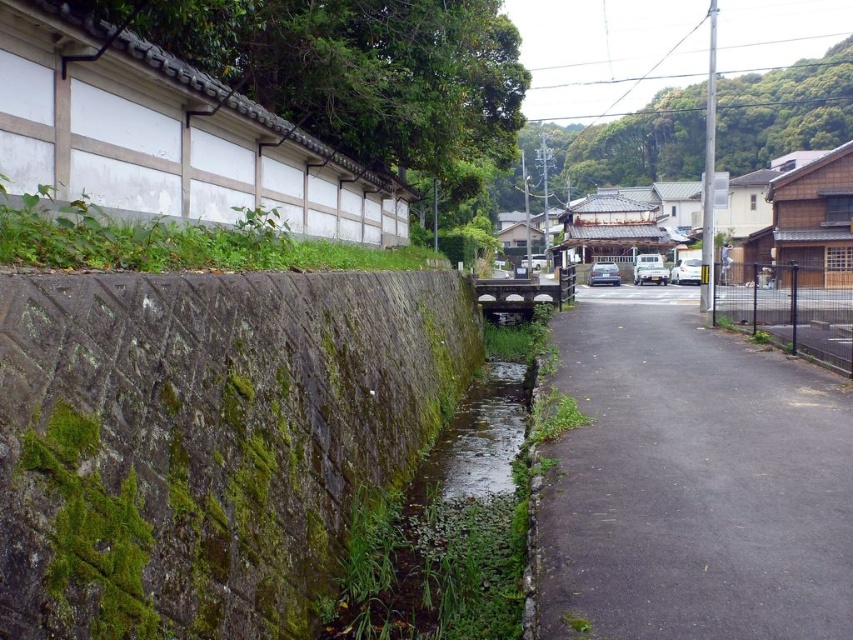
You are a pedestrian walking along the black asphalt path at center and want to reach the green mossy stone wall at left. Which direction should you walk to get there?

The green mossy stone wall at left is positioned on the left side of the black asphalt path at center, so you should walk to the left to reach it.

You are a hiker standing at the edge of the green mossy stone wall at left and want to cross to the black asphalt path at center. Is the path directly in front of you, or do you need to walk around it?

The green mossy stone wall at left is closer to the viewer than the black asphalt path at center, so the path is not directly in front of you. You will need to walk around it to reach the path.

You are a gardener who needs to cross from the green mossy stone wall at left to the black asphalt path at center with a wheelbarrow. The wheelbarrow requires a minimum of 2 meters of space to maneuver. Is the distance sufficient?

The distance between the green mossy stone wall at left and the black asphalt path at center is 3.46 meters, which is more than the required 2 meters. Therefore, the wheelbarrow can be maneuvered safely between them.